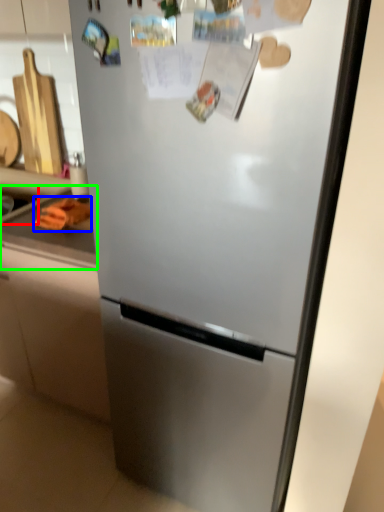
Question: Which is nearer to the sink (highlighted by a red box)? food (highlighted by a blue box) or counter top (highlighted by a green box).

Choices:
 (A) food
 (B) counter top

Answer: (A)